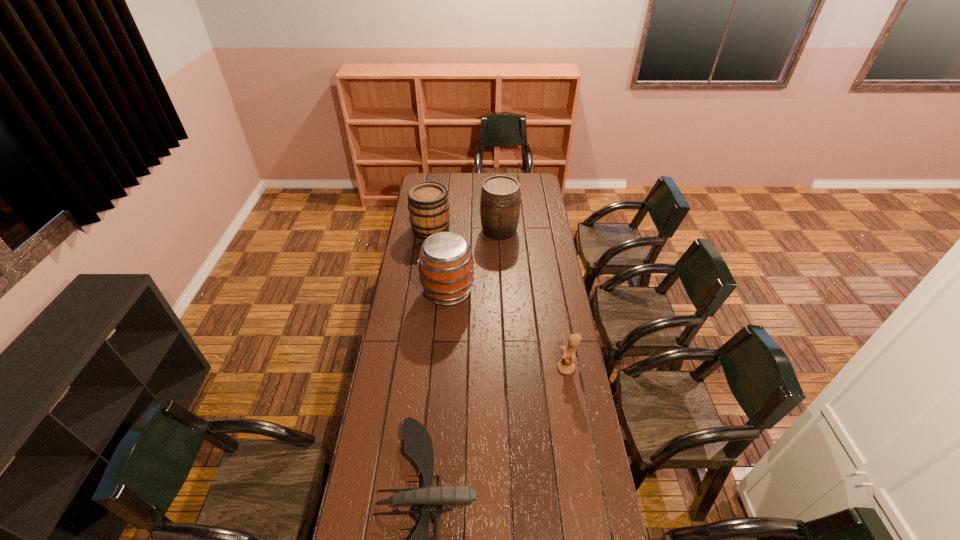
You are a GUI agent. You are given a task and a screenshot of the screen. Output one action in this format:
    pyautogui.click(x=<x>, y=<y>)
    Task: Click on the vacant point located on the front-facing side of the rightmost object
    
    Given the screenshot: What is the action you would take?
    pyautogui.click(x=503, y=368)

Image resolution: width=960 pixels, height=540 pixels. What are the coordinates of `object situated at the right edge` in the screenshot? It's located at (566, 365).

Where is `vacant space at the far edge of the desktop`? The image size is (960, 540). vacant space at the far edge of the desktop is located at coordinates (475, 181).

Identify the location of free location at the left edge. This screenshot has height=540, width=960. (420, 348).

The width and height of the screenshot is (960, 540). Find the location of `free region at the right edge`. free region at the right edge is located at coordinates (540, 224).

The height and width of the screenshot is (540, 960). Identify the location of vacant space at the far left corner of the desktop. point(441,176).

Identify the location of blank space at the far right corner of the desktop. The height and width of the screenshot is (540, 960). (x=522, y=184).

The image size is (960, 540). I want to click on free point between the nearest cider and the figurine, so click(x=507, y=330).

The image size is (960, 540). Identify the location of vacant point located between the third nearest object and the fourth farthest object. (507, 330).

The height and width of the screenshot is (540, 960). What are the coordinates of `free spot between the rightmost cider and the shortest cider` in the screenshot? It's located at (466, 230).